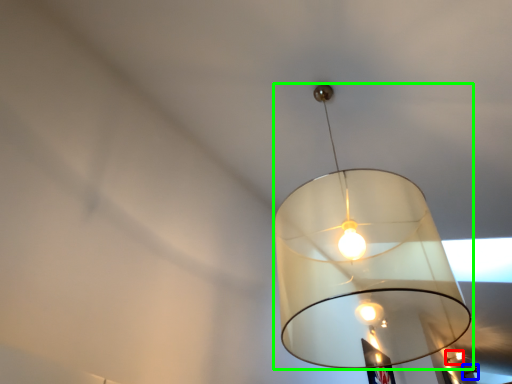
Question: Based on their relative distances, which object is farther from lamp (highlighted by a red box)? Choose from lamp (highlighted by a blue box) and lamp (highlighted by a green box).

Choices:
 (A) lamp
 (B) lamp

Answer: (B)